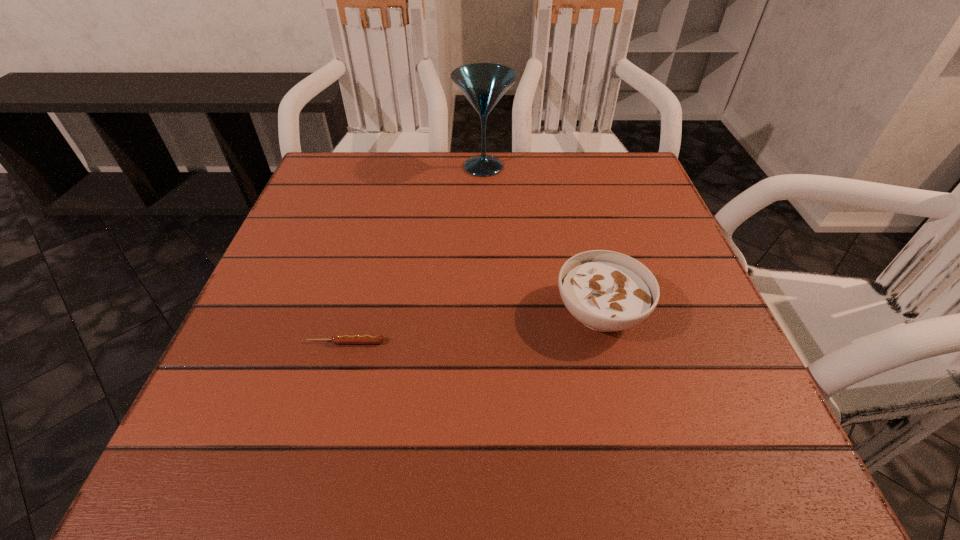
Locate an element on the screen. The image size is (960, 540). the closest object to the tallest object is located at coordinates (606, 291).